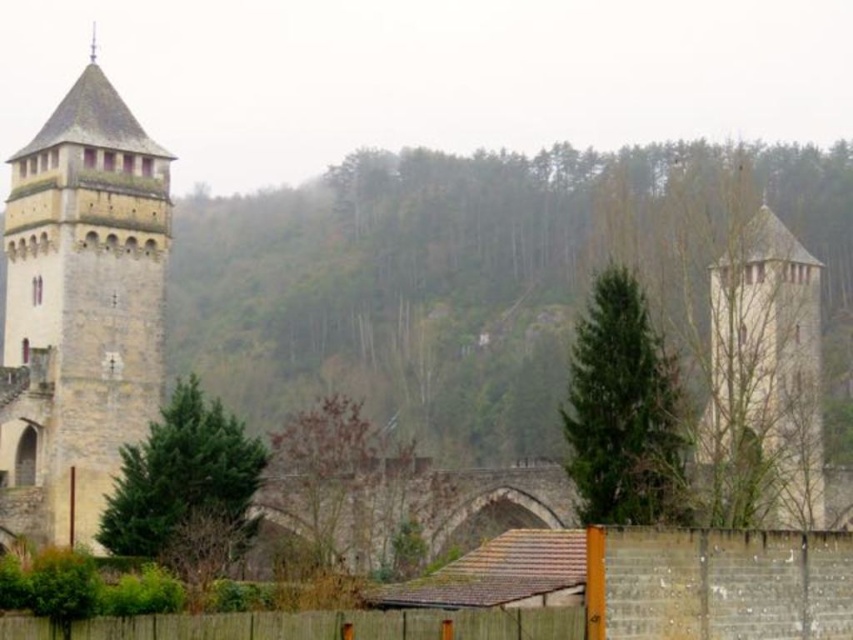
Question: Which point is closer to the camera?

Choices:
 (A) (61, 404)
 (B) (715, 600)

Answer: (B)

Question: Does stone tower at left appear over light beige stone tower at right?

Choices:
 (A) no
 (B) yes

Answer: (B)

Question: Which of the following is the farthest from the observer?

Choices:
 (A) light beige stone tower at right
 (B) brown wooden fence at lower center
 (C) stone tower at left

Answer: (A)

Question: Considering the relative positions of brown wooden fence at lower center and light beige stone tower at right in the image provided, where is brown wooden fence at lower center located with respect to light beige stone tower at right?

Choices:
 (A) above
 (B) below

Answer: (B)

Question: Which object is closer to the camera taking this photo?

Choices:
 (A) brown wooden fence at lower center
 (B) light beige stone tower at right
 (C) stone tower at left

Answer: (A)

Question: Can you confirm if stone tower at left is positioned to the left of light beige stone tower at right?

Choices:
 (A) yes
 (B) no

Answer: (A)